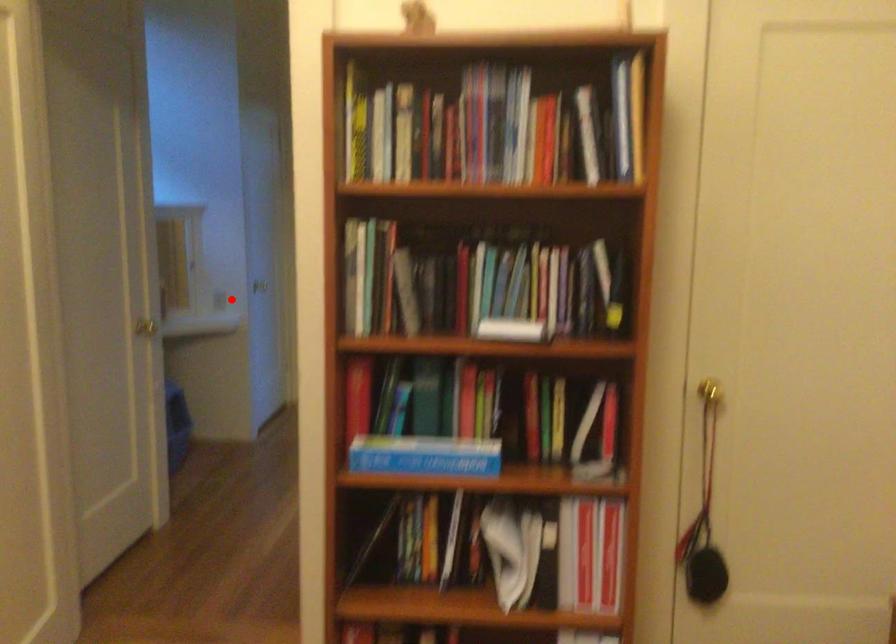
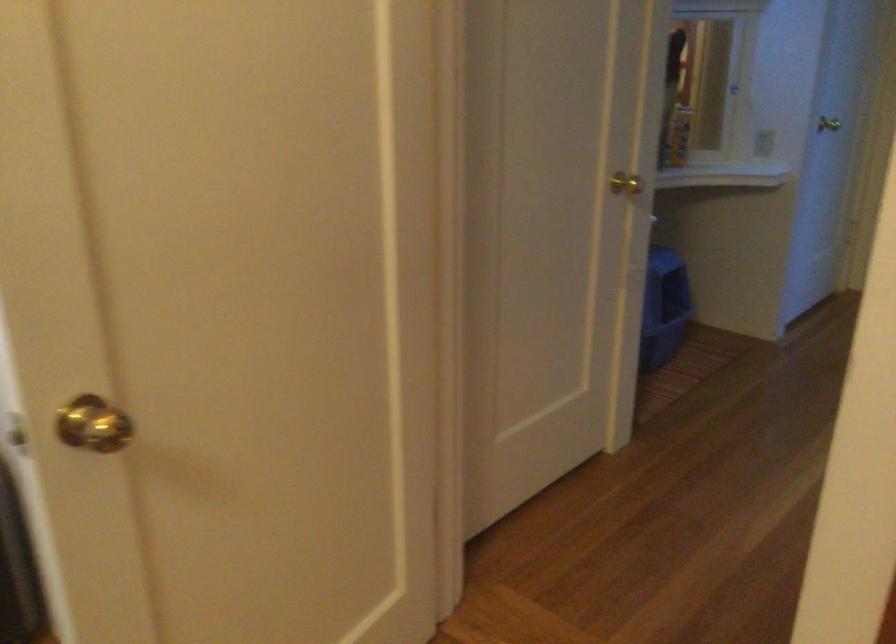
Question: I am providing you with two images of the same scene from different viewpoints. In image1, a red point is highlighted. Considering the same 3D point in image2, which of the following is correct?

Choices:
 (A) It is closer
 (B) It is farther

Answer: (A)